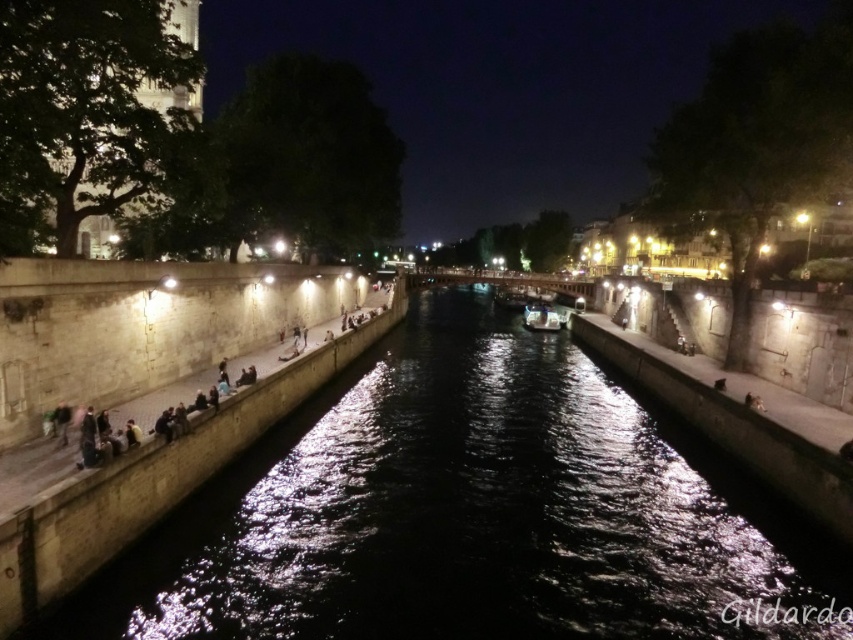
Is the position of smooth stone tower at upper left more distant than that of shiny silver boat at center?

No, smooth stone tower at upper left is in front of shiny silver boat at center.

Is point (160, 45) positioned before point (548, 310)?

Yes.

Identify the location of smooth stone tower at upper left. This screenshot has width=853, height=640. (119, 106).